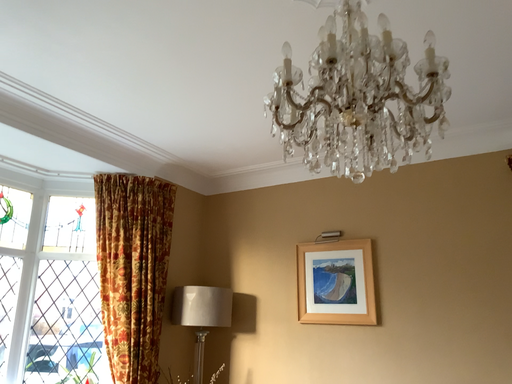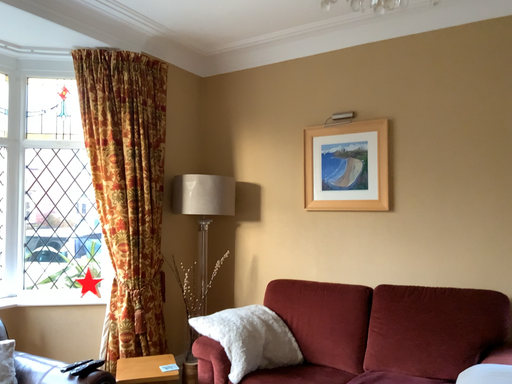
Question: How did the camera likely rotate when shooting the video?

Choices:
 (A) rotated upward
 (B) rotated downward

Answer: (B)